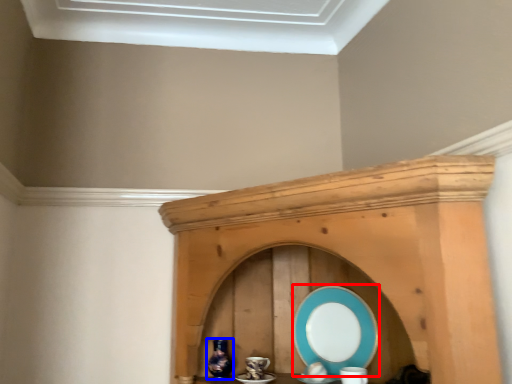
Question: Which point is further to the camera, platter (highlighted by a red box) or vase (highlighted by a blue box)?

Choices:
 (A) platter
 (B) vase

Answer: (B)